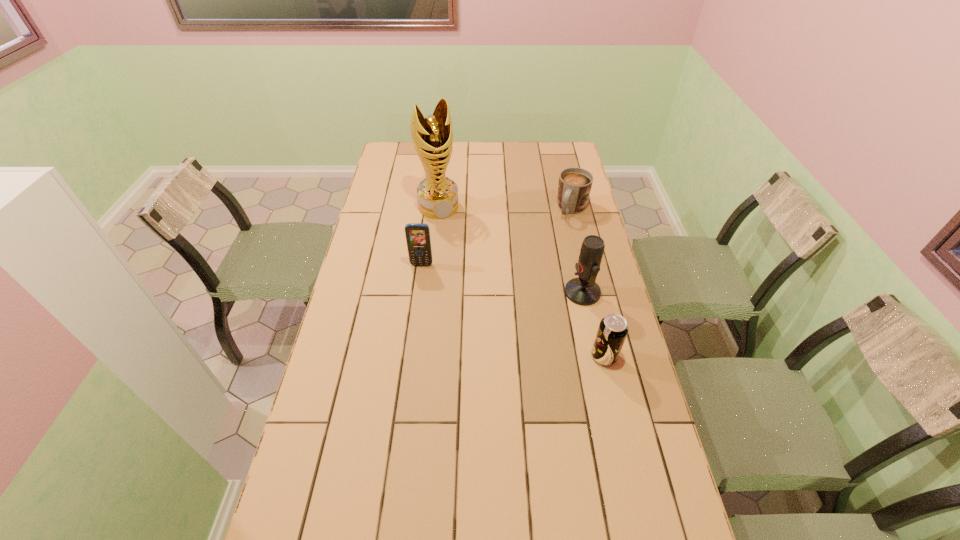
In the image, there is a desktop. Where is `vacant area at the far edge`? This screenshot has width=960, height=540. vacant area at the far edge is located at coordinates (475, 154).

Identify the location of vacant area at the left edge of the desktop. This screenshot has height=540, width=960. (393, 206).

Identify the location of vacant region at the right edge. (549, 177).

Locate an element on the screen. This screenshot has width=960, height=540. vacant area at the far left corner is located at coordinates click(399, 163).

Identify the location of free space at the far right corner. point(564,160).

This screenshot has height=540, width=960. What are the coordinates of `free spot between the award and the mug` in the screenshot? It's located at (505, 208).

Locate an element on the screen. This screenshot has width=960, height=540. blank region between the microphone and the third farthest object is located at coordinates (502, 279).

Locate an element on the screen. vacant area that lies between the mug and the cellular telephone is located at coordinates (497, 237).

The height and width of the screenshot is (540, 960). Identify the location of vacant space that's between the mug and the cellular telephone. (497, 237).

The height and width of the screenshot is (540, 960). I want to click on free space between the second tallest object and the cellular telephone, so click(x=502, y=279).